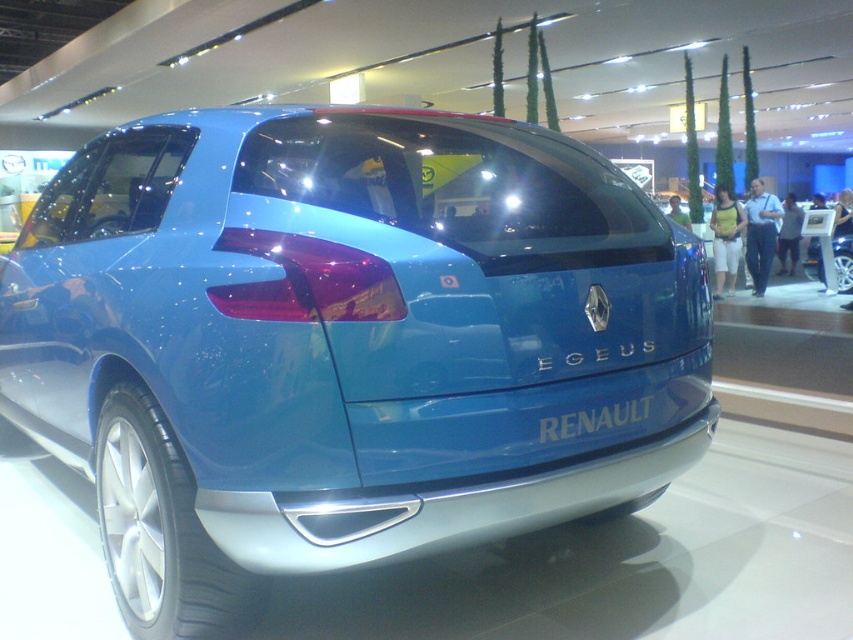
Question: Can you confirm if glossy blue car at center is positioned to the right of matte blue car at center?

Choices:
 (A) yes
 (B) no

Answer: (B)

Question: Does glossy blue car at center lie behind matte blue car at center?

Choices:
 (A) yes
 (B) no

Answer: (B)

Question: Which of the following is the closest to the observer?

Choices:
 (A) (219, 502)
 (B) (827, 282)

Answer: (A)

Question: Can you confirm if glossy blue car at center is thinner than matte blue car at center?

Choices:
 (A) no
 (B) yes

Answer: (A)

Question: Which object is closer to the camera taking this photo?

Choices:
 (A) glossy blue car at center
 (B) matte blue car at center

Answer: (A)